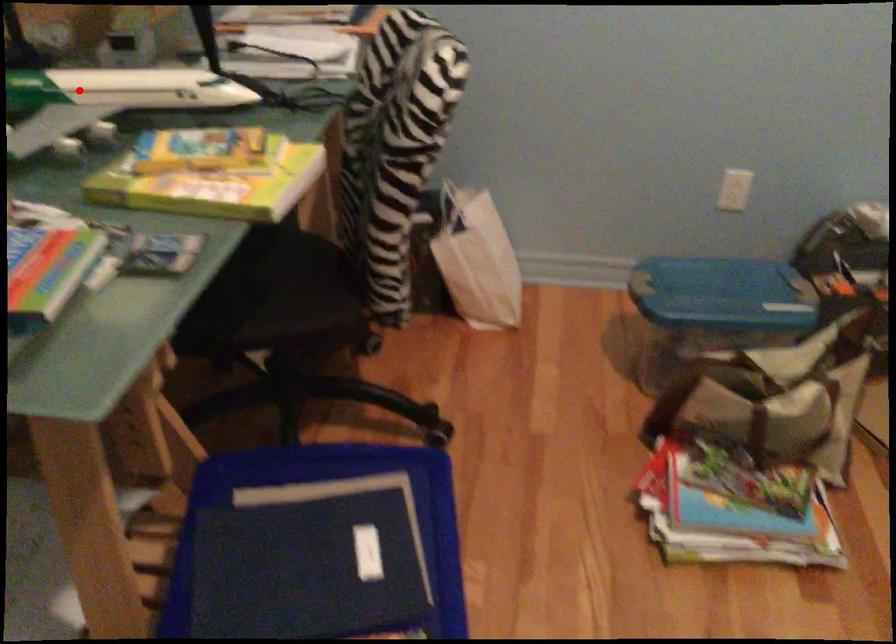
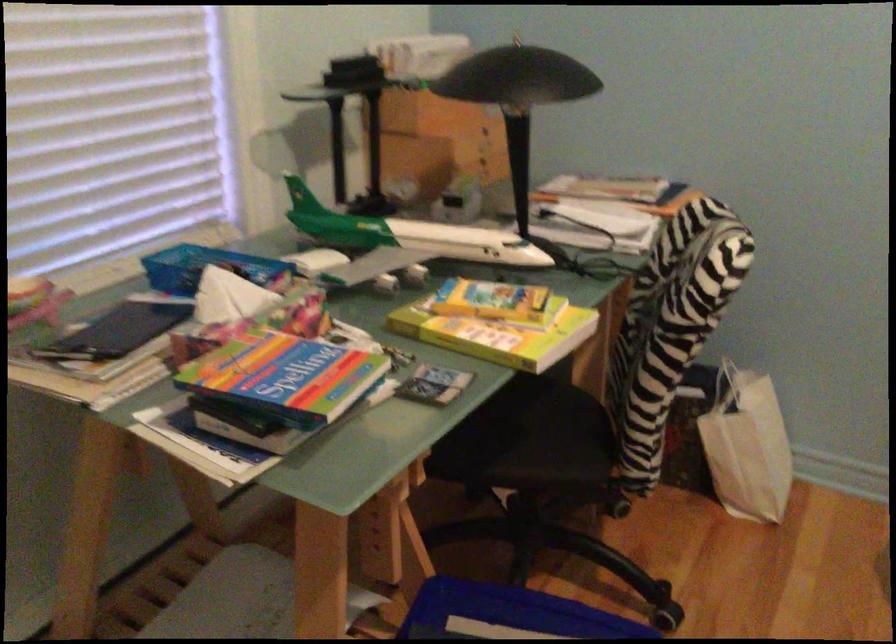
Question: I am providing you with two images of the same scene from different viewpoints. Image1 has a red point marked. In image2, the corresponding 3D location appears at what relative position? Reply with the corresponding letter.

Choices:
 (A) Closer
 (B) Farther

Answer: (B)